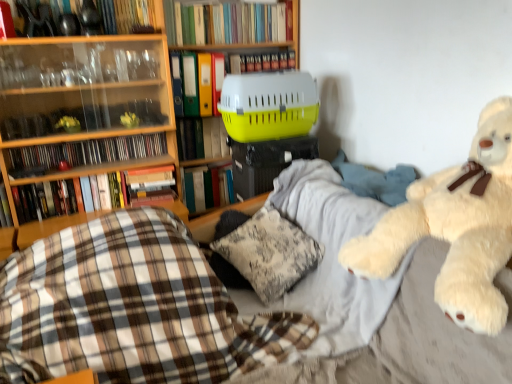
Question: Is yellow plastic pet carrier at center, positioned as the fifth book in bottom-to-top order, oriented away from hardcover book at upper center, placed as the third book when sorted from top to bottom?

Choices:
 (A) yes
 (B) no

Answer: (B)

Question: Would you say yellow plastic pet carrier at center, positioned as the fifth book in bottom-to-top order, is a long distance from hardcover book at upper center, positioned as the 7th book in bottom-to-top order?

Choices:
 (A) yes
 (B) no

Answer: (B)

Question: From a real-world perspective, does yellow plastic pet carrier at center, positioned as the fifth book in bottom-to-top order, stand above hardcover book at upper center, placed as the third book when sorted from top to bottom?

Choices:
 (A) no
 (B) yes

Answer: (A)

Question: Is yellow plastic pet carrier at center, positioned as the fifth book in bottom-to-top order, at the left side of hardcover book at upper center, positioned as the 7th book in bottom-to-top order?

Choices:
 (A) yes
 (B) no

Answer: (A)

Question: From the image's perspective, does yellow plastic pet carrier at center, which is counted as the fifth book, starting from the top, appear higher than hardcover book at upper center, placed as the third book when sorted from top to bottom?

Choices:
 (A) yes
 (B) no

Answer: (B)

Question: From a real-world perspective, does yellow plastic pet carrier at center, positioned as the fifth book in bottom-to-top order, sit lower than hardcover book at upper center, placed as the third book when sorted from top to bottom?

Choices:
 (A) yes
 (B) no

Answer: (A)

Question: Is plastic cd case at upper left, the 4th book ordered from the bottom, smaller than yellow plastic pet carrier at center?

Choices:
 (A) yes
 (B) no

Answer: (A)

Question: Are plastic cd case at upper left, acting as the sixth book starting from the top, and yellow plastic pet carrier at center located far from each other?

Choices:
 (A) yes
 (B) no

Answer: (B)

Question: Is plastic cd case at upper left, the 4th book ordered from the bottom, not within yellow plastic pet carrier at center?

Choices:
 (A) yes
 (B) no

Answer: (A)

Question: From the image's perspective, is plastic cd case at upper left, the 4th book ordered from the bottom, beneath yellow plastic pet carrier at center?

Choices:
 (A) no
 (B) yes

Answer: (B)

Question: Does plastic cd case at upper left, acting as the sixth book starting from the top, have a greater height compared to yellow plastic pet carrier at center?

Choices:
 (A) yes
 (B) no

Answer: (B)

Question: Is plastic cd case at upper left, the 4th book ordered from the bottom, positioned in front of yellow plastic pet carrier at center?

Choices:
 (A) no
 (B) yes

Answer: (B)

Question: Is hardcover book at left, placed as the 8th book when sorted from top to bottom, positioned in front of yellow plastic pet carrier at center, positioned as the fifth book in bottom-to-top order?

Choices:
 (A) no
 (B) yes

Answer: (B)